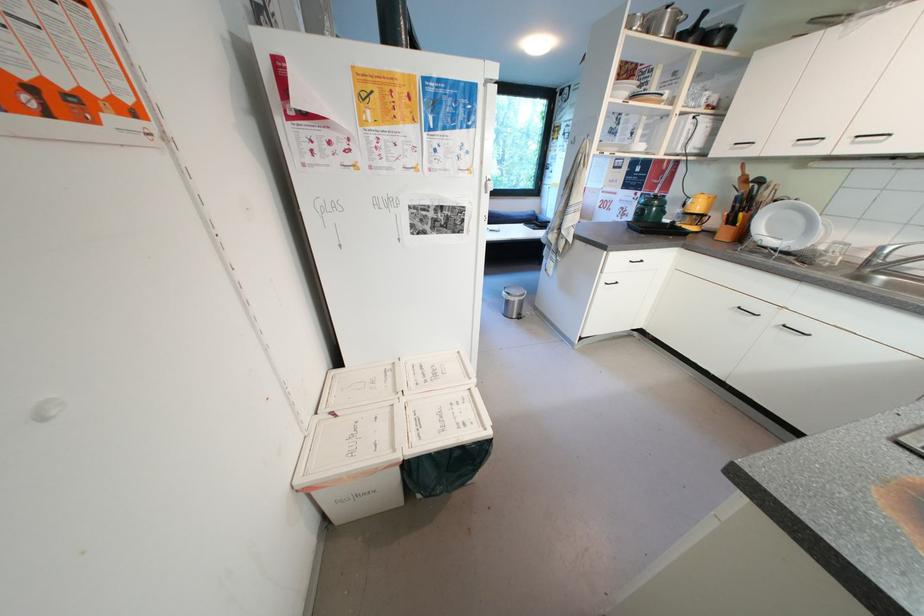
Where would you lift the drinking glass? Please return your answer as a coordinate pair (x, y).

(832, 253)